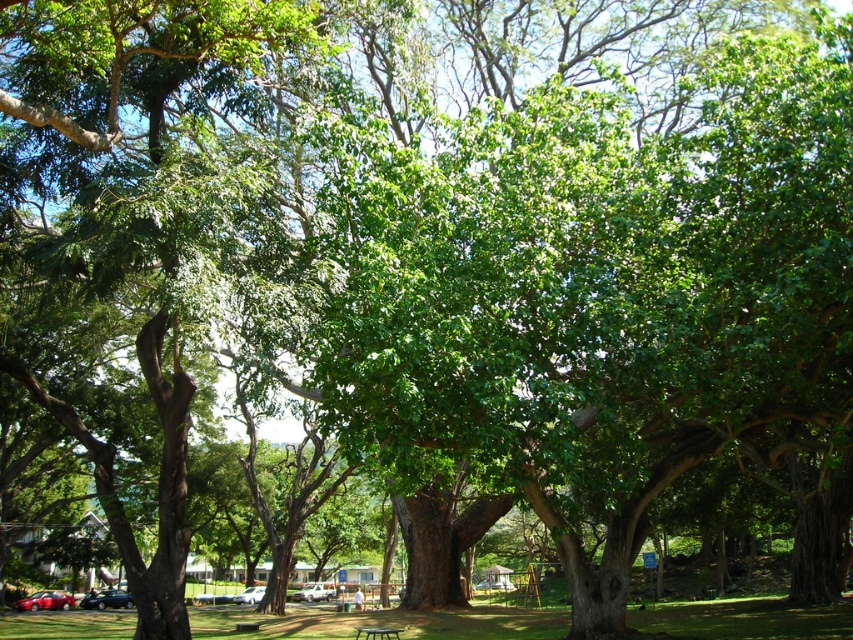
You are standing at the picnic area and want to move towards the shiny red sedan at lower left. Which direction should you walk relative to the black plastic bench at center?

You should walk downward relative to the black plastic bench at center because the shiny red sedan at lower left is positioned below it.

You are standing at the picnic table in the foreground of the park scene. You want to take a photo of the large trees with their sprawling canopies without the shiny red sedan at lower left blocking the view. Where should you position yourself relative to the sedan to ensure it doesn not appear in your photo?

To avoid the shiny red sedan at lower left blocking the view, position yourself to the right side of the sedan since its coordinates are at point (x=45, y=602), meaning it is located near the lower left corner of the image. By moving to the right, you can frame the shot so the sedan is out of the camera frame.